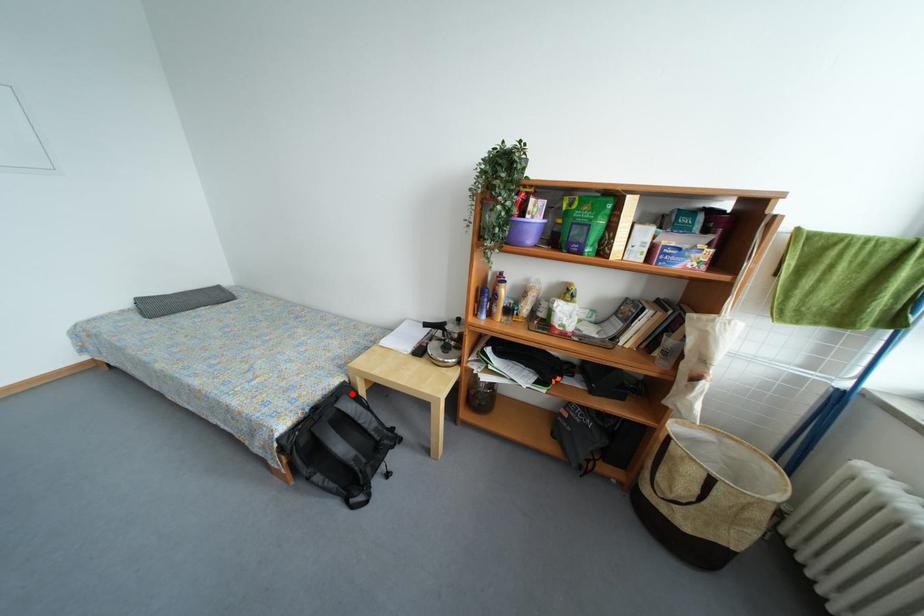
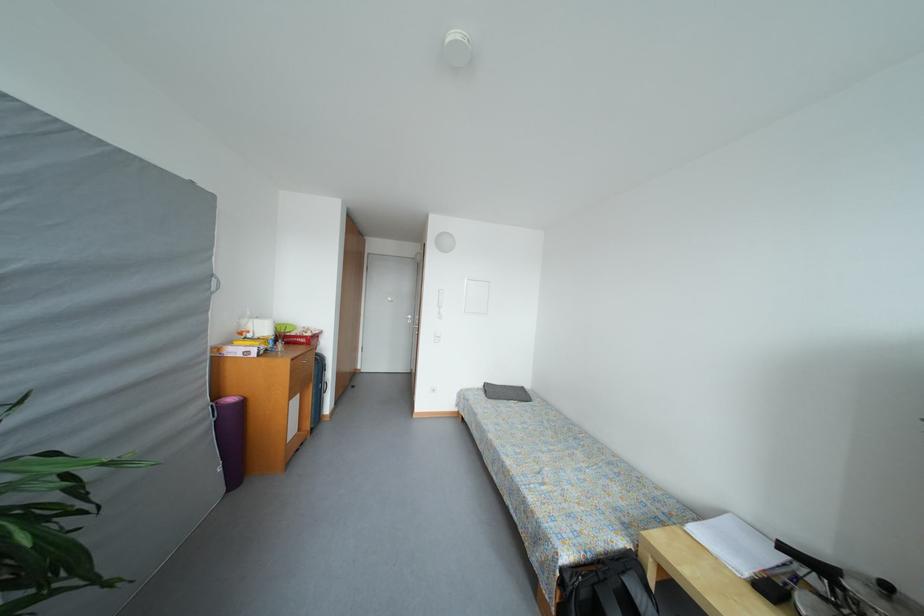
Locate, in the second image, the point that corresponds to the highlighted location in the first image.

(638, 567)